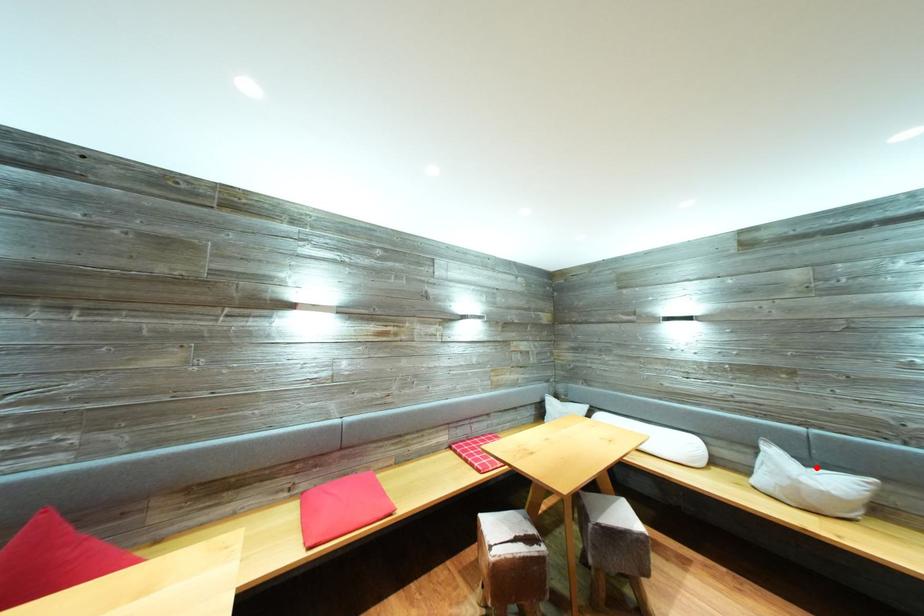
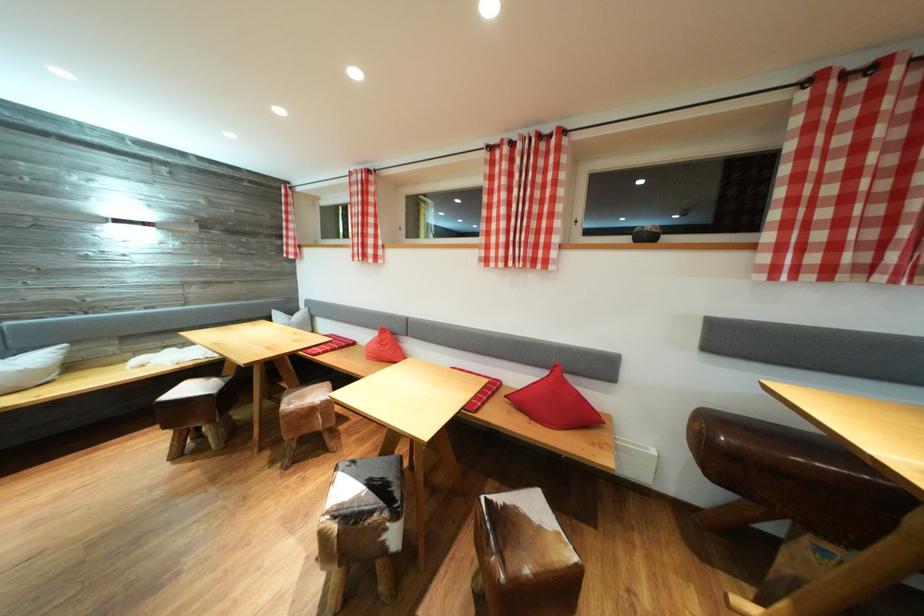
Locate, in the second image, the point that corresponds to the highlighted location in the first image.

(14, 358)